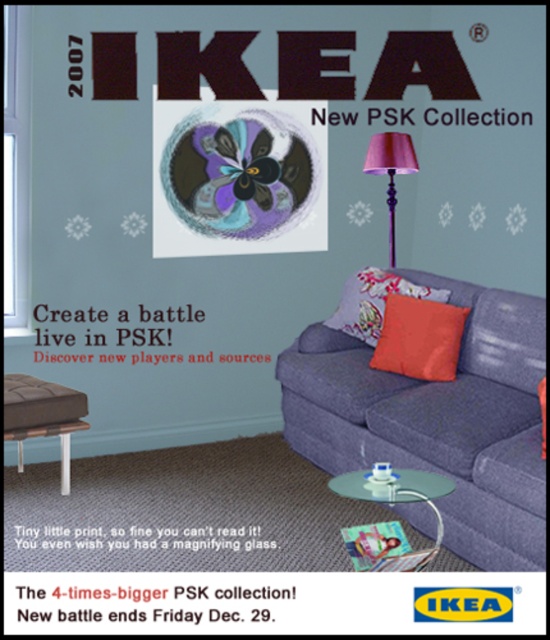
Question: Is purple fabric lampshade at upper right below white glossy stool at lower left?

Choices:
 (A) no
 (B) yes

Answer: (A)

Question: Is orange matte cushion at center closer to camera compared to purple fabric lampshade at upper right?

Choices:
 (A) yes
 (B) no

Answer: (A)

Question: Which object is the closest to the orange fabric pillow at center?

Choices:
 (A) purple fabric lampshade at upper right
 (B) orange matte cushion at center
 (C) matte plastic flyer at lower center
 (D) white glossy stool at lower left

Answer: (B)

Question: Which point is closer to the camera?

Choices:
 (A) (69, 480)
 (B) (458, 298)
 (C) (359, 312)

Answer: (B)

Question: Which point appears closest to the camera in this image?

Choices:
 (A) (388, 260)
 (B) (542, 374)
 (C) (389, 307)
 (D) (327, 321)

Answer: (B)

Question: Does orange matte cushion at center appear on the right side of matte plastic flyer at lower center?

Choices:
 (A) no
 (B) yes

Answer: (B)